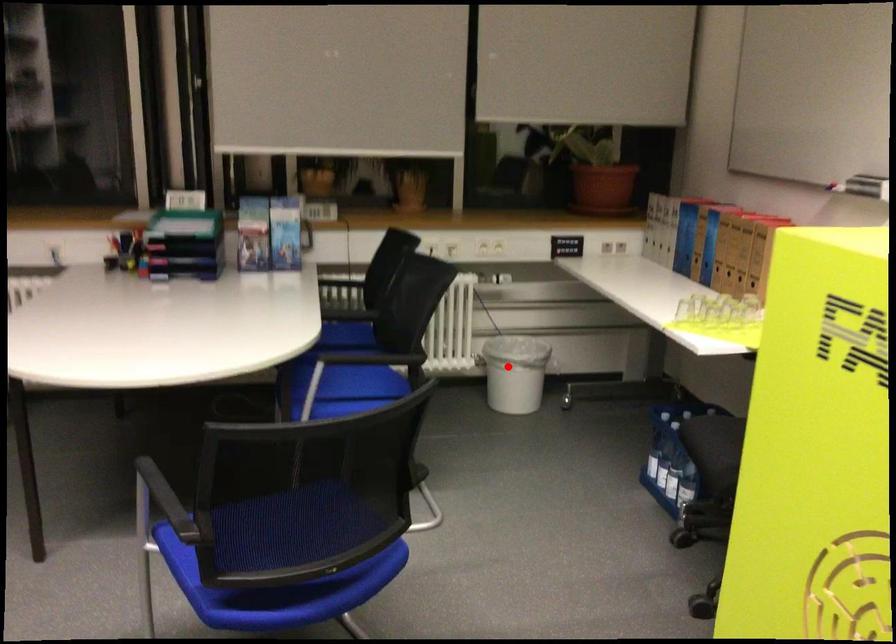
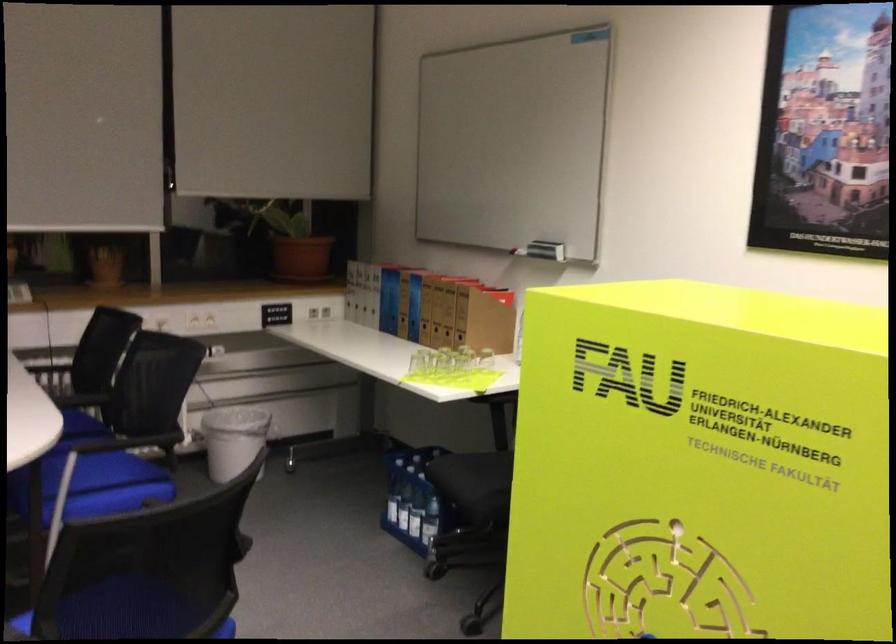
Find the pixel in the second image that matches the highlighted location in the first image.

(234, 440)